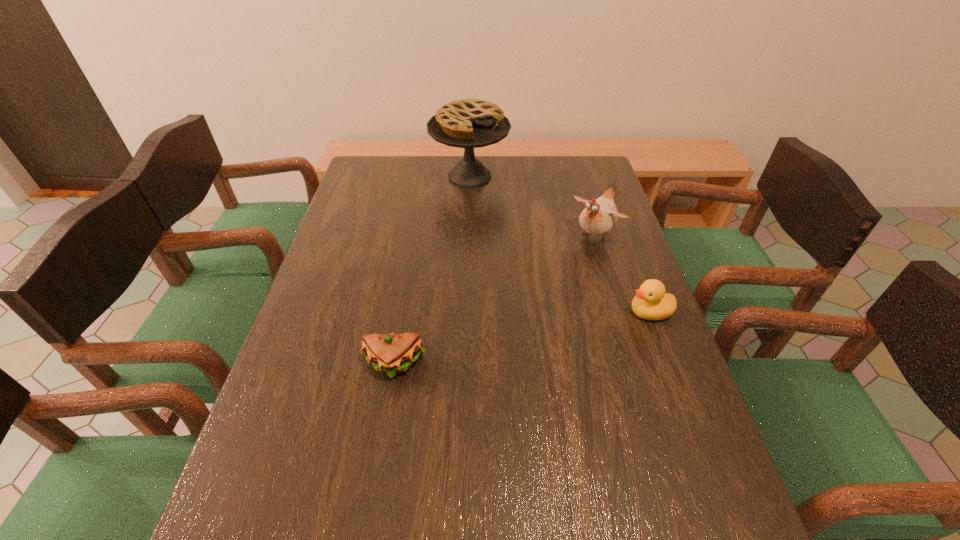
Where is `vacant space on the desktop that is between the sandwich and the duckling and is positioned at the beak of the second farthest object`? The image size is (960, 540). vacant space on the desktop that is between the sandwich and the duckling and is positioned at the beak of the second farthest object is located at coordinates (492, 345).

Find the location of `free spot on the desktop that is between the sandwich and the duckling and is positioned on the cut side of the pie`. free spot on the desktop that is between the sandwich and the duckling and is positioned on the cut side of the pie is located at coordinates (565, 329).